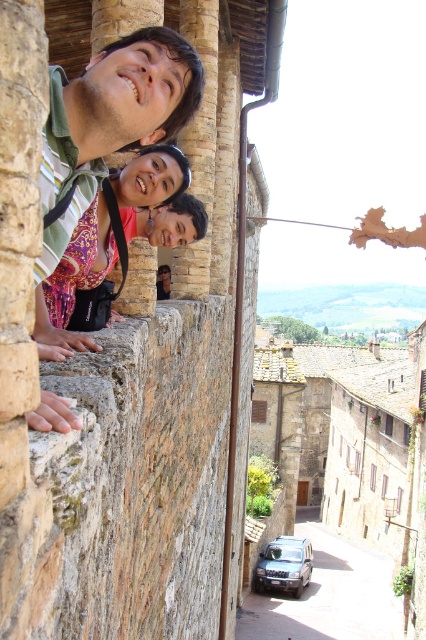
Question: Which of the following is the closest to the observer?

Choices:
 (A) (302, 554)
 (B) (123, 84)

Answer: (B)

Question: In this image, where is matte black camera at upper left located relative to dark gray metallic car at lower center?

Choices:
 (A) right
 (B) left

Answer: (B)

Question: Does matte black camera at upper left have a lesser width compared to dark gray metallic car at lower center?

Choices:
 (A) yes
 (B) no

Answer: (A)

Question: Which of the following is the closest to the observer?

Choices:
 (A) (268, 552)
 (B) (131, 116)

Answer: (B)

Question: Among these points, which one is nearest to the camera?

Choices:
 (A) (271, 564)
 (B) (201, 92)

Answer: (B)

Question: Is matte black camera at upper left below dark gray metallic car at lower center?

Choices:
 (A) yes
 (B) no

Answer: (B)